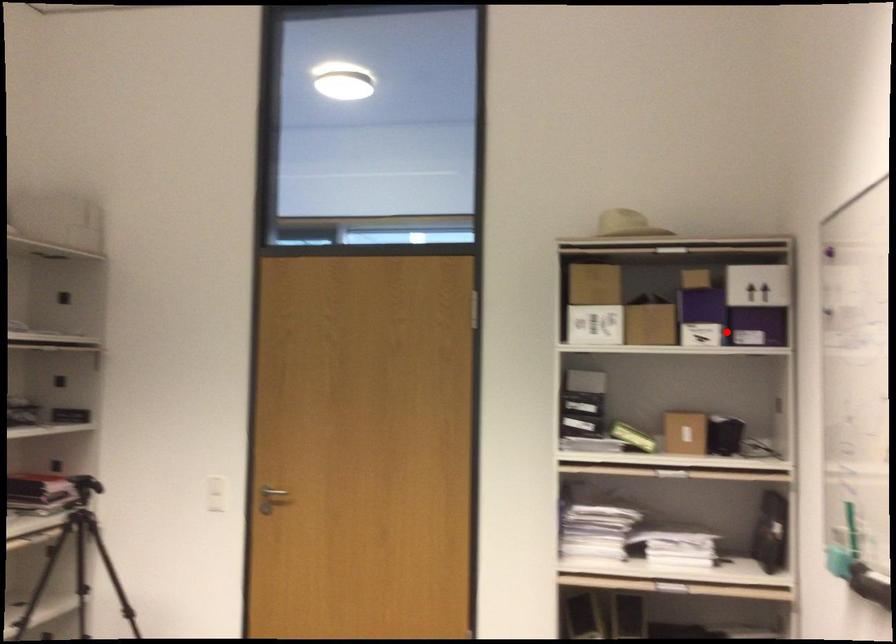
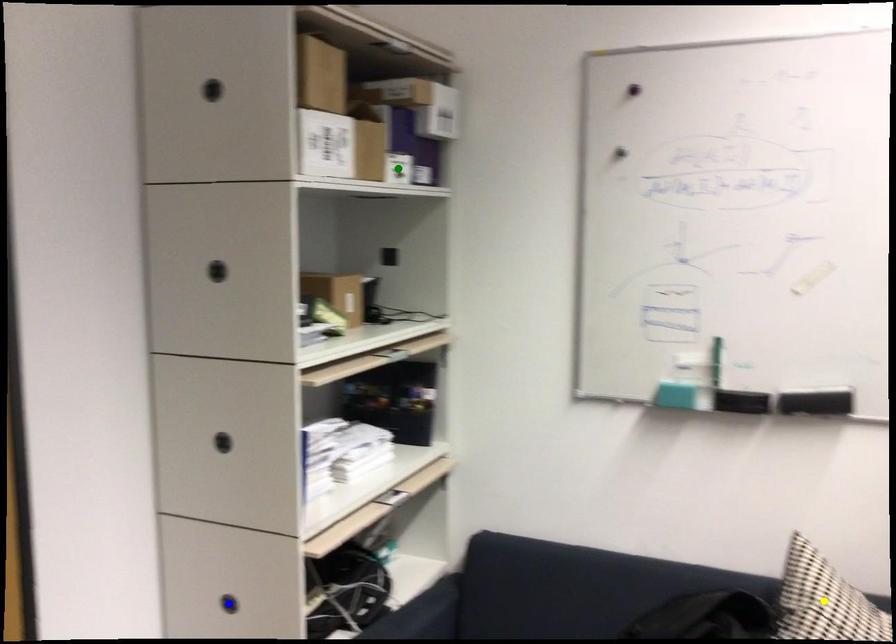
Question: I am providing you with two images of the same scene from different viewpoints. A red point is marked on the first image. You are given multiple points on the second image. Which mark in image 2 goes with the point in image 1?

Choices:
 (A) blue point
 (B) green point
 (C) yellow point

Answer: (B)